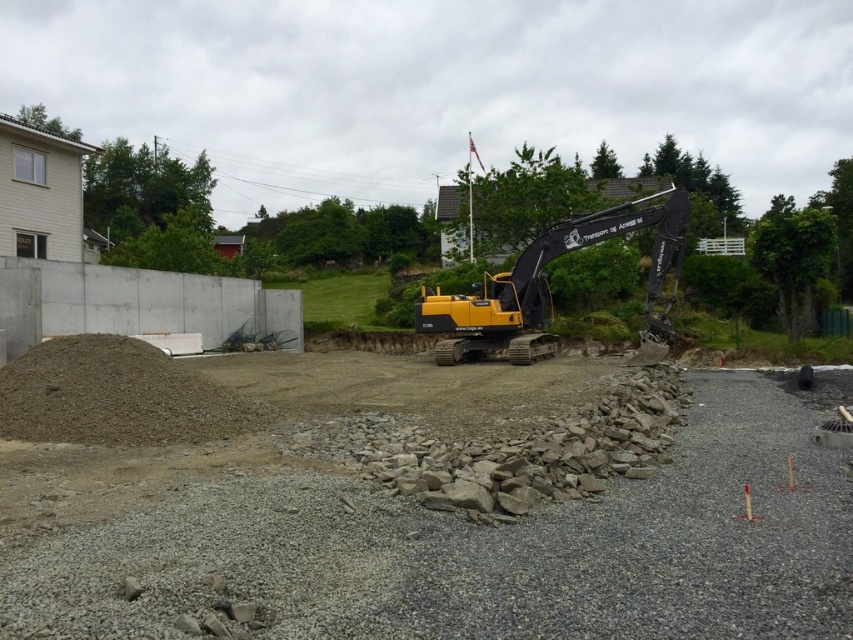
What are the coordinates of `gray gravel pile at lower left` in the screenshot? It's located at (117, 396).

Does gray gravel pile at lower left have a greater width compared to yellow/black excavator at center?

In fact, gray gravel pile at lower left might be narrower than yellow/black excavator at center.

Is point (103, 413) positioned behind point (575, 227)?

That is False.

I want to click on gray gravel pile at lower left, so click(117, 396).

Which is above, gray gravel at center or yellow/black excavator at center?

yellow/black excavator at center is above.

Which is in front, point (181, 572) or point (543, 243)?

Point (181, 572)

The width and height of the screenshot is (853, 640). I want to click on gray gravel at center, so click(440, 515).

From the picture: Between gray gravel at center and gray gravel pile at lower left, which one has less height?

gray gravel at center

In the scene shown: Can you confirm if gray gravel at center is positioned to the left of gray gravel pile at lower left?

Incorrect, gray gravel at center is not on the left side of gray gravel pile at lower left.

Between point (126, 541) and point (19, 362), which one is positioned in front?

Point (126, 541)

This screenshot has height=640, width=853. I want to click on gray gravel at center, so click(440, 515).